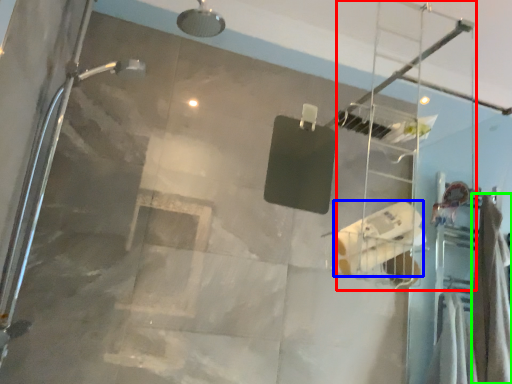
Question: Which is farther away from ladder (highlighted by a red box)? toilet paper (highlighted by a blue box) or shower curtain (highlighted by a green box)?

Choices:
 (A) toilet paper
 (B) shower curtain

Answer: (A)